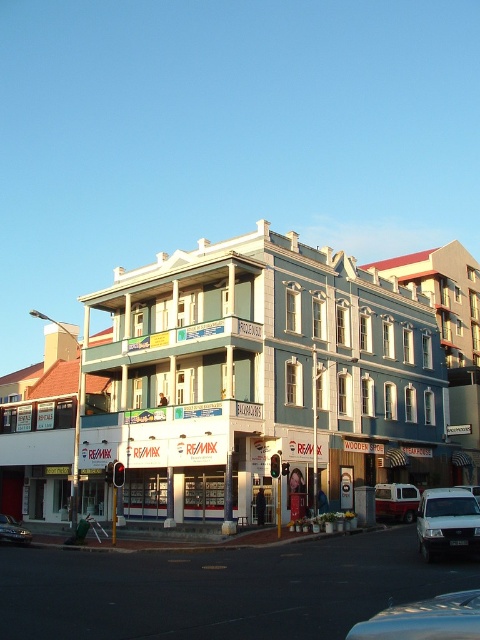
Is white matte van at lower right positioned before shiny silver car at lower left?

Yes, it is.

Does white matte van at lower right have a greater height compared to shiny silver car at lower left?

In fact, white matte van at lower right may be shorter than shiny silver car at lower left.

The image size is (480, 640). In order to click on white matte van at lower right in this screenshot , I will do `click(447, 522)`.

I want to click on white matte van at lower right, so click(x=447, y=522).

Does white matte van at lower right appear on the right side of metallic silver van at center?

No, white matte van at lower right is not to the right of metallic silver van at center.

Is white matte van at lower right bigger than metallic silver van at center?

Yes, white matte van at lower right is bigger than metallic silver van at center.

Is point (468, 516) positioned before point (406, 518)?

That is True.

Identify the location of white matte van at lower right. point(447,522).

Who is lower down, white matte van at lower right or white matte van at center?

white matte van at center is lower down.

Which of these two, white matte van at lower right or white matte van at center, stands taller?

With more height is white matte van at center.

Is point (453, 547) closer to viewer compared to point (468, 484)?

Yes, point (453, 547) is closer to viewer.

At what (x,y) coordinates should I click in order to perform the action: click on white matte van at lower right. Please return your answer as a coordinate pair (x, y). Looking at the image, I should click on (447, 522).